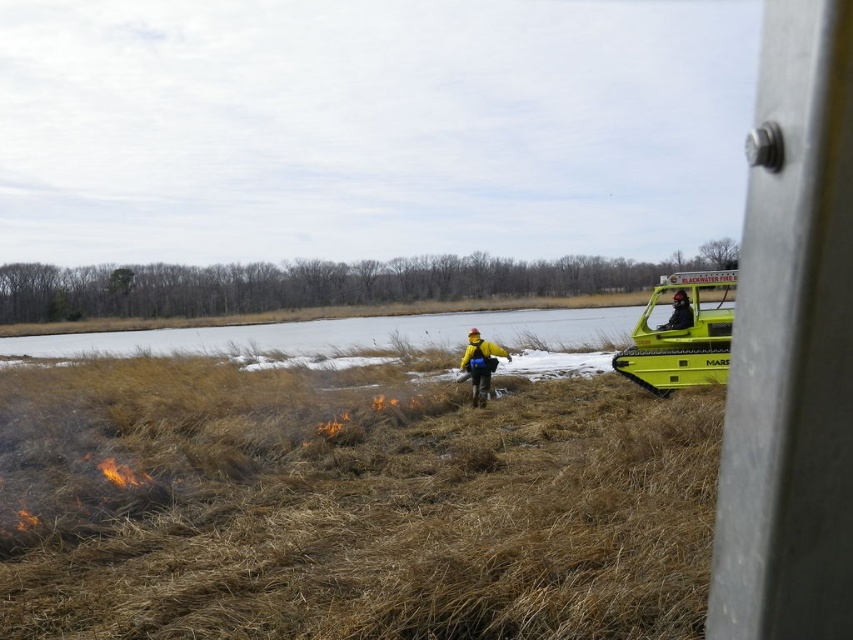
Based on the photo, does yellow matte jacket at center come in front of black matte helmet at center?

Yes.

Is yellow matte jacket at center further to the viewer compared to black matte helmet at center?

No, yellow matte jacket at center is in front of black matte helmet at center.

What do you see at coordinates (480, 364) in the screenshot? I see `yellow matte jacket at center` at bounding box center [480, 364].

What are the coordinates of `yellow matte jacket at center` in the screenshot? It's located at (480, 364).

Which is above, brown dry grass at center or black matte helmet at center?

black matte helmet at center

Which is in front, point (28, 528) or point (688, 308)?

Point (28, 528) is more forward.

Identify the location of brown dry grass at center. This screenshot has height=640, width=853. (347, 506).

What are the coordinates of `brown dry grass at center` in the screenshot? It's located at (347, 506).

Can you confirm if brown dry grass at center is bigger than yellow matte jacket at center?

Correct, brown dry grass at center is larger in size than yellow matte jacket at center.

Can you confirm if brown dry grass at center is positioned above yellow matte jacket at center?

Incorrect, brown dry grass at center is not positioned above yellow matte jacket at center.

Does point (432, 605) come closer to viewer compared to point (471, 352)?

Yes, it is.

This screenshot has height=640, width=853. I want to click on brown dry grass at center, so click(x=347, y=506).